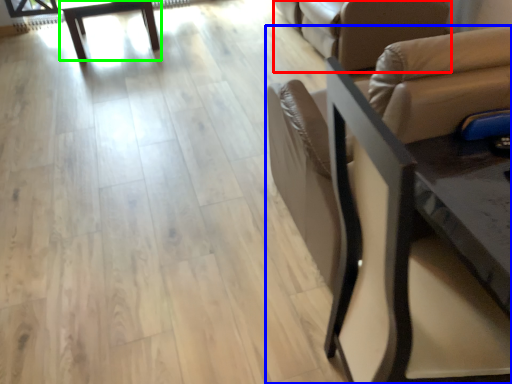
Question: Estimate the real-world distances between objects in this image. Which object is closer to futon (highlighted by a red box), chair (highlighted by a blue box) or table (highlighted by a green box)?

Choices:
 (A) chair
 (B) table

Answer: (A)